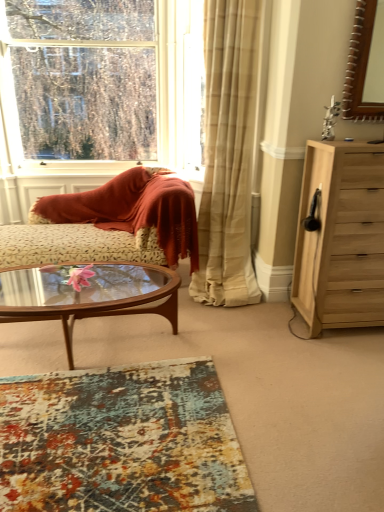
At what (x,y) coordinates should I click in order to perform the action: click on free area below wooden mirror at upper right (from a real-world perspective). Please return your answer as a coordinate pair (x, y). This screenshot has width=384, height=512. Looking at the image, I should click on (357, 133).